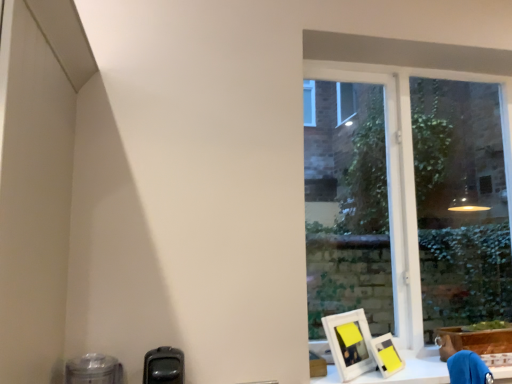
Question: Should I look upward or downward to see brown cardboard box at lower right?

Choices:
 (A) down
 (B) up

Answer: (A)

Question: From the image's perspective, is transparent glass window at right located above white matte picture frame at lower right, which appears as the 1th picture frame when viewed from the left?

Choices:
 (A) no
 (B) yes

Answer: (B)

Question: Is transparent glass window at right looking in the opposite direction of white matte picture frame at lower right, which appears as the 1th picture frame when viewed from the left?

Choices:
 (A) no
 (B) yes

Answer: (B)

Question: Would you say white matte picture frame at lower right, which appears as the 1th picture frame when viewed from the left, is part of transparent glass window at right's contents?

Choices:
 (A) yes
 (B) no

Answer: (B)

Question: From a real-world perspective, is transparent glass window at right physically below white matte picture frame at lower right, which appears as the 1th picture frame when viewed from the left?

Choices:
 (A) no
 (B) yes

Answer: (A)

Question: From a real-world perspective, is transparent glass window at right on top of white matte picture frame at lower right, which is the second picture frame from right to left?

Choices:
 (A) yes
 (B) no

Answer: (A)

Question: Are transparent glass window at right and white matte picture frame at lower right, which is the second picture frame from right to left, located far from each other?

Choices:
 (A) yes
 (B) no

Answer: (B)

Question: From a real-world perspective, is white matte picture frame at lower right, which appears as the 1th picture frame when viewed from the left, positioned over matte yellow picture frame at lower right, which is the 2th picture frame in left-to-right order, based on gravity?

Choices:
 (A) yes
 (B) no

Answer: (A)

Question: Considering the relative sizes of white matte picture frame at lower right, which appears as the 1th picture frame when viewed from the left, and matte yellow picture frame at lower right, the 1th picture frame viewed from the right, in the image provided, is white matte picture frame at lower right, which appears as the 1th picture frame when viewed from the left, taller than matte yellow picture frame at lower right, the 1th picture frame viewed from the right,?

Choices:
 (A) yes
 (B) no

Answer: (A)

Question: Does white matte picture frame at lower right, which is the second picture frame from right to left, have a lesser width compared to matte yellow picture frame at lower right, which is the 2th picture frame in left-to-right order?

Choices:
 (A) no
 (B) yes

Answer: (A)

Question: Can you confirm if white matte picture frame at lower right, which appears as the 1th picture frame when viewed from the left, is bigger than matte yellow picture frame at lower right, which is the 2th picture frame in left-to-right order?

Choices:
 (A) no
 (B) yes

Answer: (B)

Question: Does white matte picture frame at lower right, which is the second picture frame from right to left, turn towards matte yellow picture frame at lower right, which is the 2th picture frame in left-to-right order?

Choices:
 (A) no
 (B) yes

Answer: (B)

Question: Are white matte picture frame at lower right, which appears as the 1th picture frame when viewed from the left, and matte yellow picture frame at lower right, which is the 2th picture frame in left-to-right order, located far from each other?

Choices:
 (A) yes
 (B) no

Answer: (B)

Question: Does transparent glass window at right have a lesser width compared to matte yellow picture frame at lower right, the 1th picture frame viewed from the right?

Choices:
 (A) yes
 (B) no

Answer: (B)